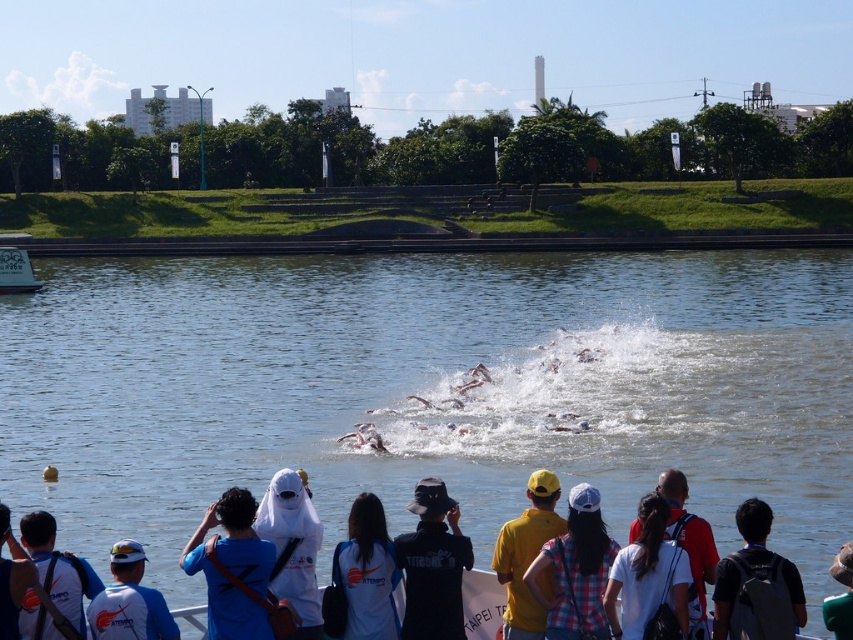
Can you confirm if white matte/soft fabric at center is positioned to the right of dark gray backpack at lower right?

No, white matte/soft fabric at center is not to the right of dark gray backpack at lower right.

Who is positioned more to the right, white matte/soft fabric at center or dark gray backpack at lower right?

dark gray backpack at lower right

Where is `white matte/soft fabric at center`? This screenshot has height=640, width=853. white matte/soft fabric at center is located at coordinates (292, 547).

The width and height of the screenshot is (853, 640). Find the location of `white matte/soft fabric at center`. white matte/soft fabric at center is located at coordinates (292, 547).

Is yellow fabric cap at center smaller than yellow matte shirt at center?

No, yellow fabric cap at center is not smaller than yellow matte shirt at center.

Does point (577, 632) come closer to viewer compared to point (543, 516)?

Yes, it is in front of point (543, 516).

Where is `yellow fabric cap at center`? yellow fabric cap at center is located at coordinates (576, 570).

Identify the location of yellow fabric cap at center. The height and width of the screenshot is (640, 853). (576, 570).

I want to click on blue fabric bag at lower left, so click(231, 568).